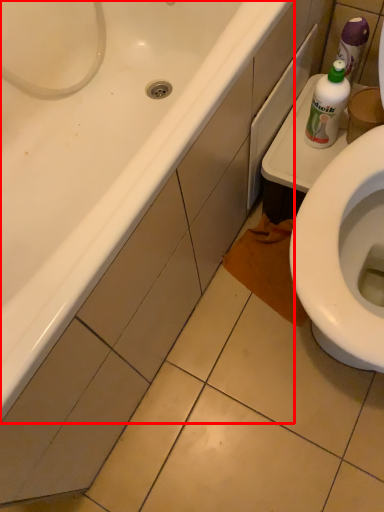
Question: In this image, where is bathtub (annotated by the red box) located relative to bottle?

Choices:
 (A) left
 (B) right

Answer: (A)